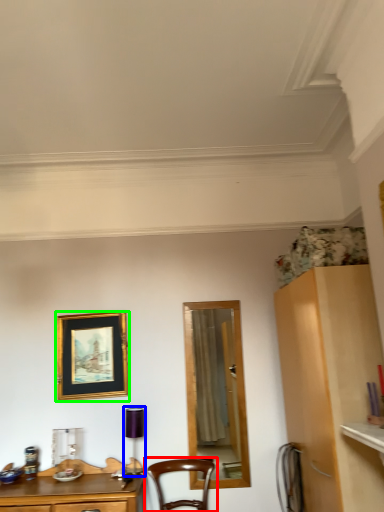
Question: Which is farther away from chair (highlighted by a red box)? lamp (highlighted by a blue box) or picture frame (highlighted by a green box)?

Choices:
 (A) lamp
 (B) picture frame

Answer: (B)